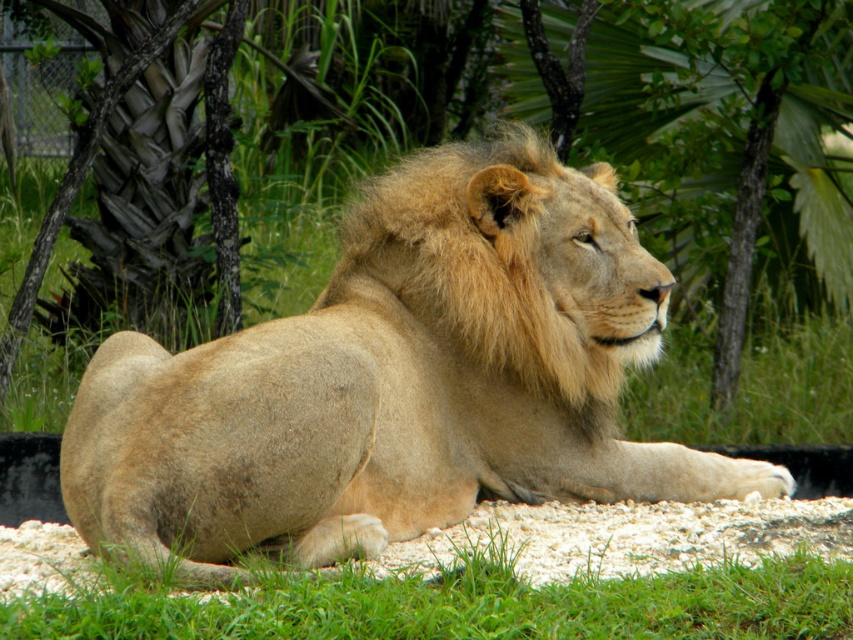
You are standing at the center of the image. Which direction should you move to reach the golden fur lion at center?

Since the golden fur lion at center is located at point coordinates of (x=398, y=381), you should move slightly to the right and forward to reach it from the center.

You are a zookeeper who needs to ensure the golden fur lion at center has enough space to move comfortably. Considering the green grass at lower center is part of its enclosure, can you determine if the lion has sufficient space based on their sizes?

The golden fur lion at center is wider than the green grass at lower center, so the lion may not have enough space to move comfortably within the grass area since it is narrower than the lion itself.